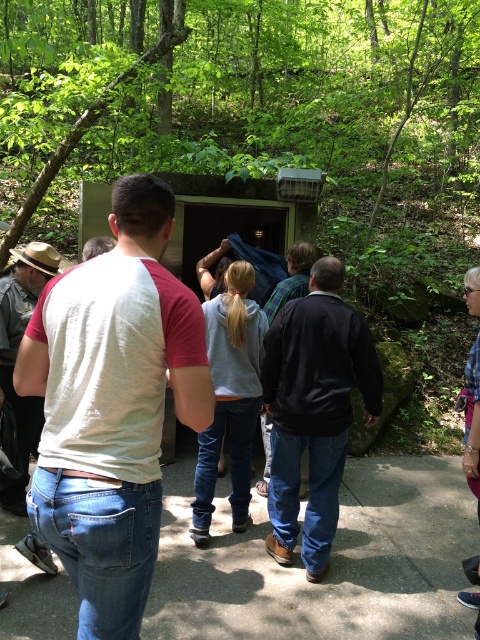
You are planning to take a photo of the green leafy forest at center and the black leather jacket at center. Since you want both subjects to be clearly visible, which one should you focus on first to ensure proper depth of field?

The green leafy forest at center is wider than the black leather jacket at center, so focusing on the black leather jacket at center first will ensure both are in focus due to its smaller size.